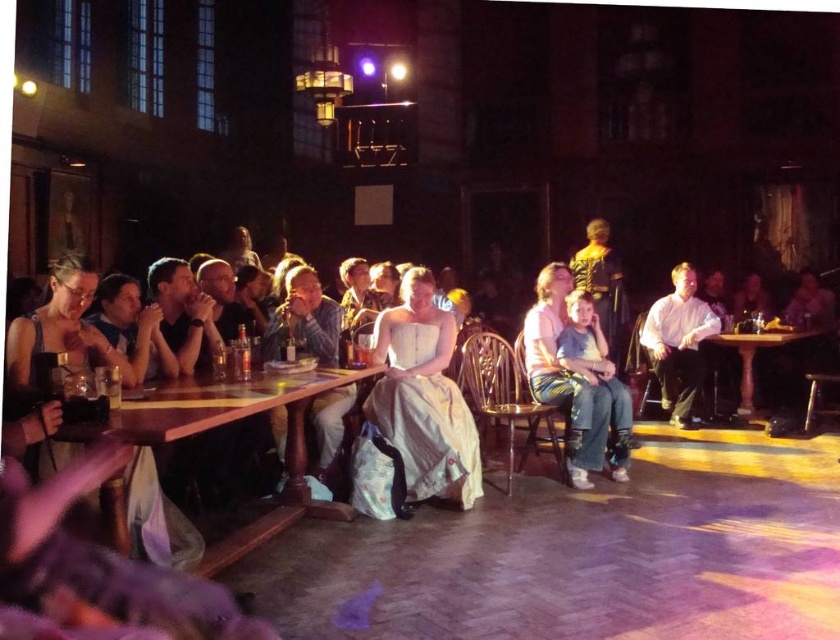
You are organizing a photo shoot and need to place a 1.2 meter wide backdrop behind the white satin dress at center and the wooden table at lower left. Based on their widths, which object requires more space horizontally to accommodate the backdrop?

The wooden table at lower left requires more space horizontally because it is wider than the white satin dress at center, which is thinner. The backdrop should be placed to accommodate the table first.

You are at a social event in a historical hall and notice two items at the center of the room. You see a denim jacket at center and a light blue jeans at center. Which item is positioned to the left when facing the center of the room?

The denim jacket at center is to the left of the light blue jeans at center when facing the center of the room.

You are a guest at this event and want to place a rectangular box that is 18 inches wide on a table between the denim jacket at center and the light blue jeans at center. Can the box fit between them based on their widths?

The denim jacket at center is wider than the light blue jeans at center. Since the box is 18 inches wide, it depends on the actual width of the space between them. However, the description only states the jacket is wider, not the exact measurement. Without specific dimensions, we cannot confirm if the box will fit.